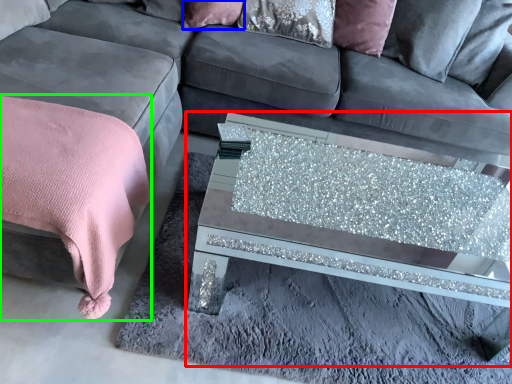
Question: Which object is the farthest from coffee table (highlighted by a red box)? Choose among these: pillow (highlighted by a blue box) or blanket (highlighted by a green box).

Choices:
 (A) pillow
 (B) blanket

Answer: (A)